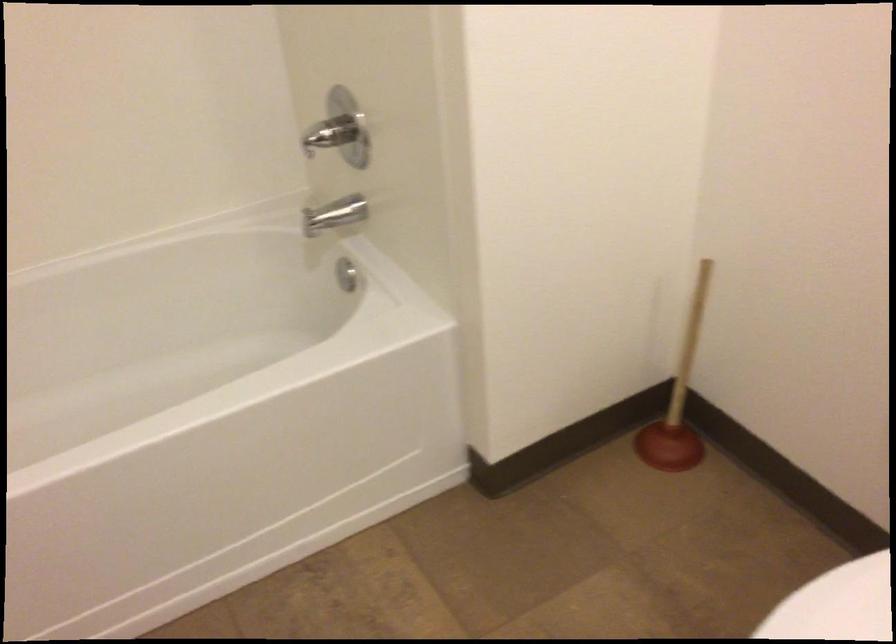
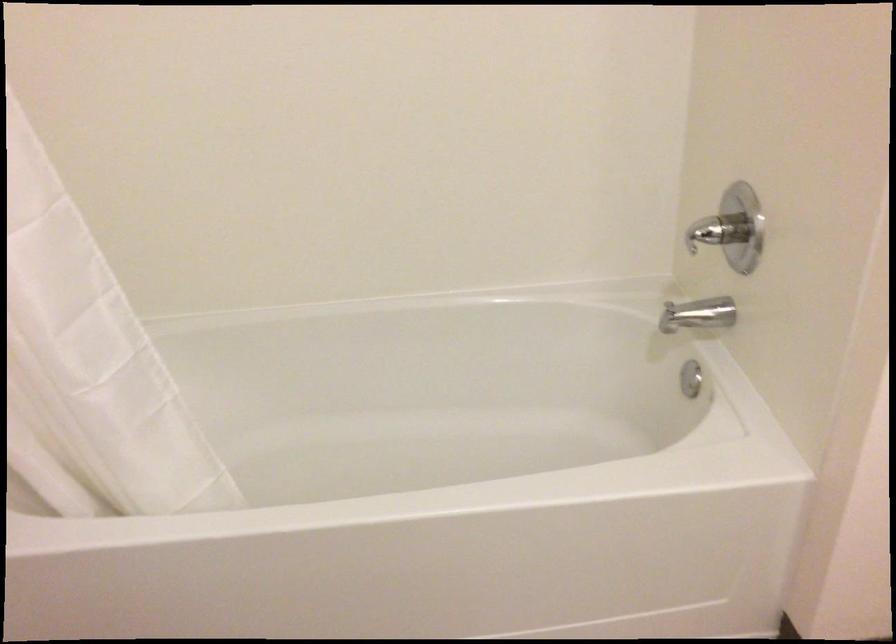
In a continuous first-person perspective shot, in which direction is the camera moving?

The movement direction of the cameraman is left, forward.